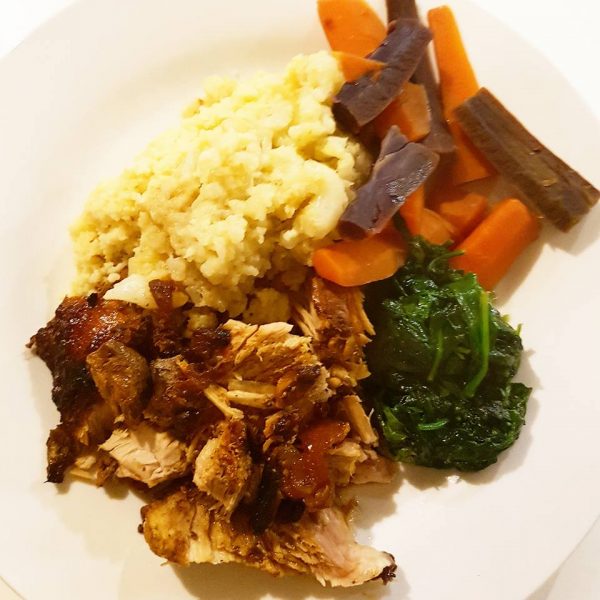
Image resolution: width=600 pixels, height=600 pixels. What are the coordinates of `plate` in the screenshot? It's located at (546, 503).